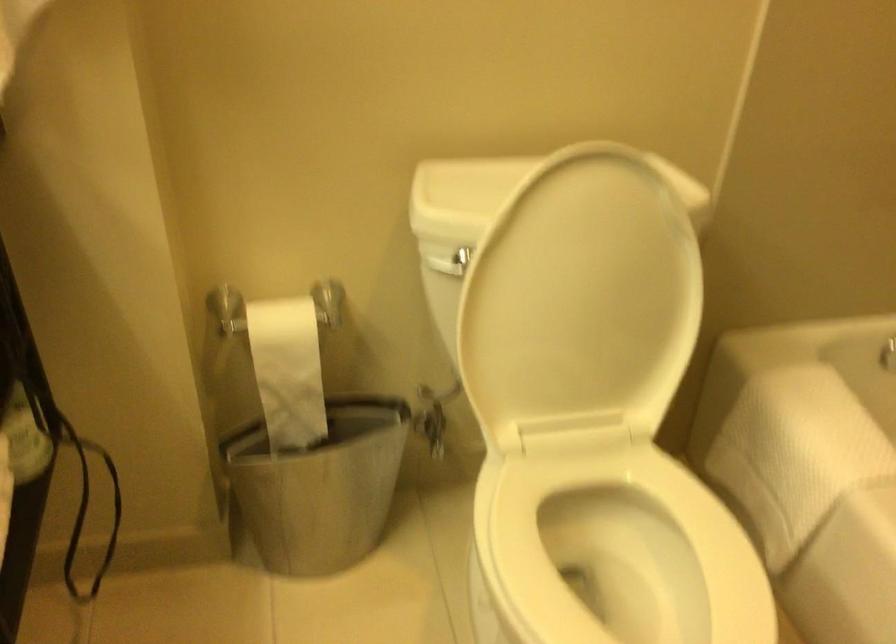
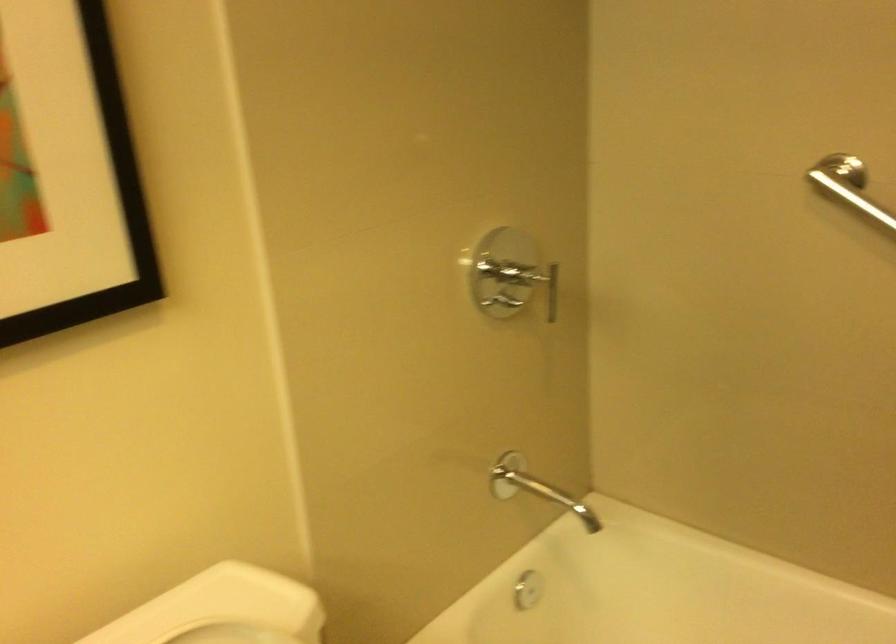
Question: The camera is either moving clockwise (left) or counter-clockwise (right) around the object. The first image is from the beginning of the video and the second image is from the end. Is the camera moving left or right when shooting the video?

Choices:
 (A) Left
 (B) Right

Answer: (A)